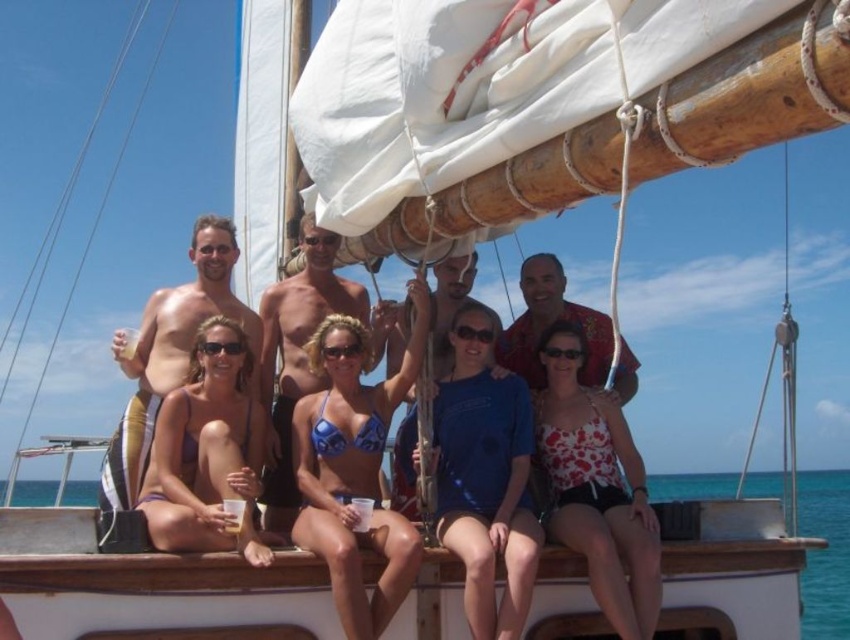
You are a photographer on the deck of the sailboat and want to capture both the smooth tan skin at center and the blue shirt at center in a single shot. Which subject should you focus on first to ensure both are in frame?

The smooth tan skin at center is taller than the blue shirt at center, so focusing on the smooth tan skin at center first will help ensure both are in frame.

You are a photographer on the deck of the sailboat and want to take a photo of the purple bikini at center. Where should you aim your camera to capture it?

You should aim your camera at point (207,452) to capture the purple bikini at center.

Based on the scene description and the coordinates provided, what is located at the point with coordinates (170,352)?

The point at coordinates (170,352) has smooth tan skin at center.